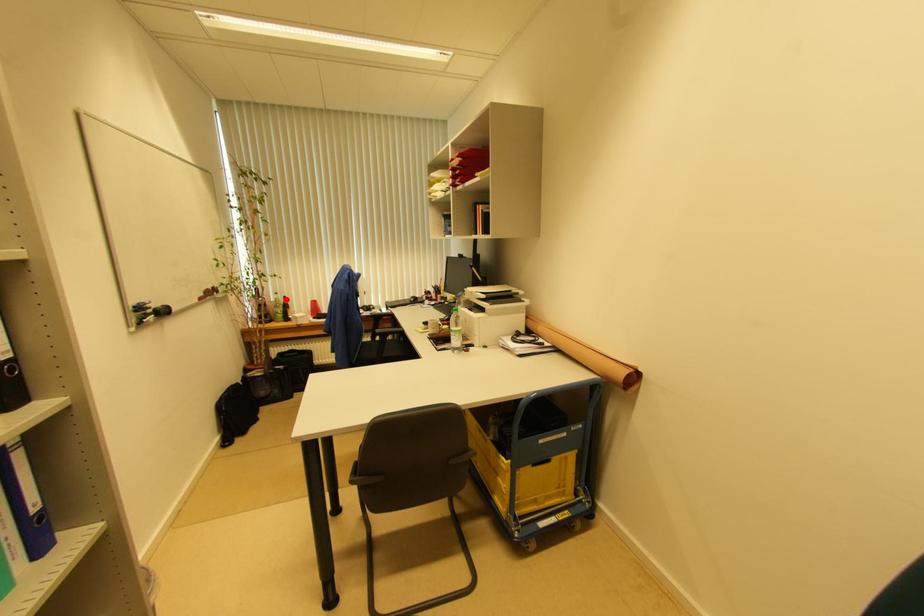
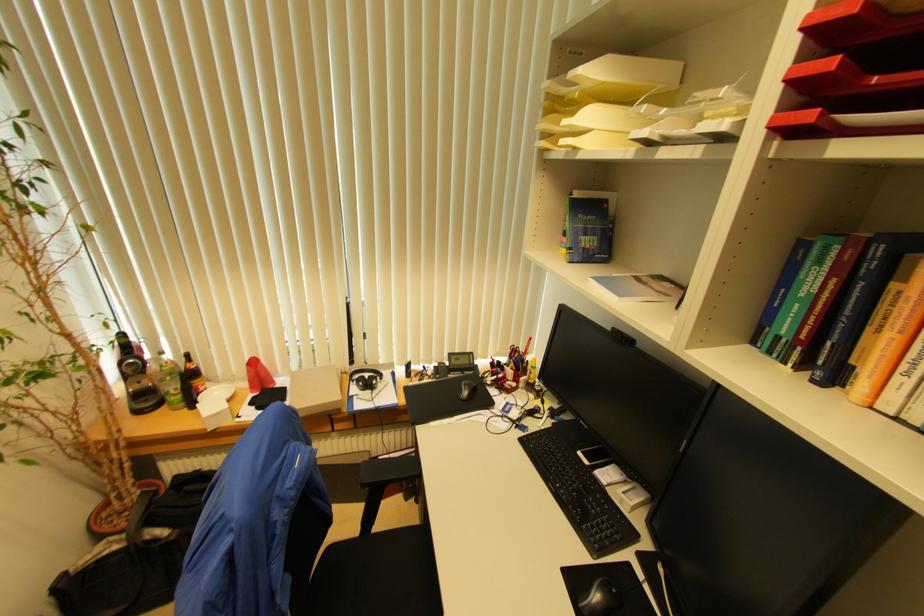
Find the pixel in the second image that matches the highlighted location in the first image.

(188, 358)